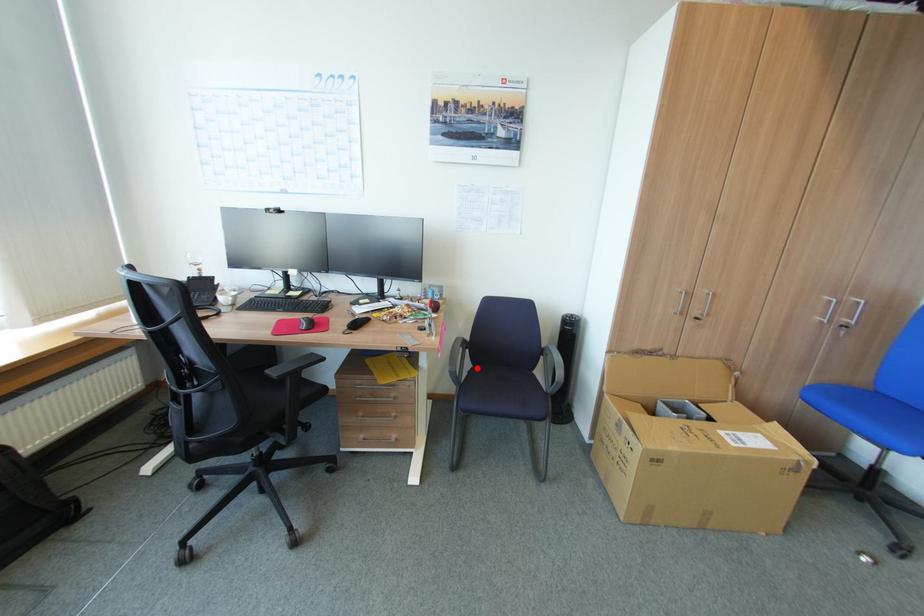
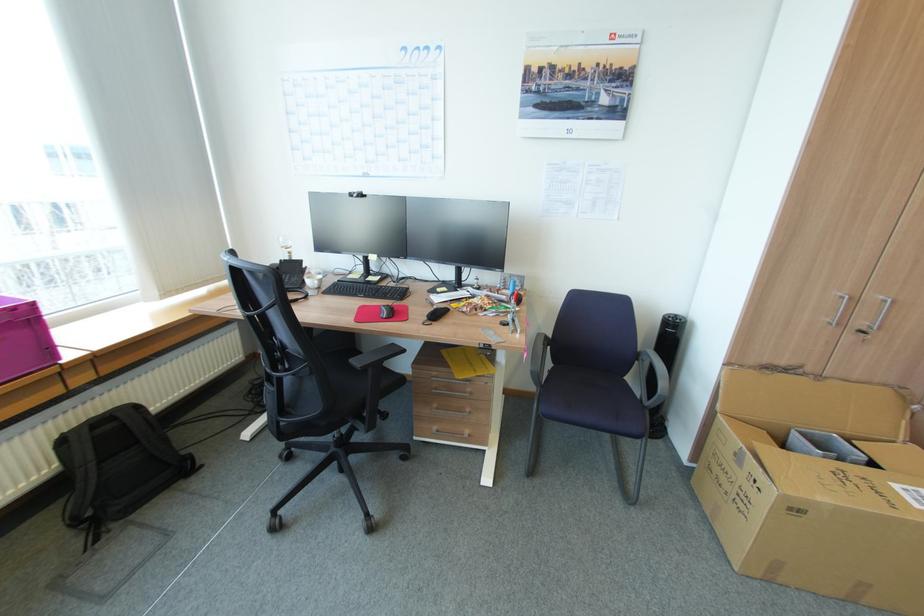
Where in the second image is the point corresponding to the highlighted location from the first image?

(557, 368)